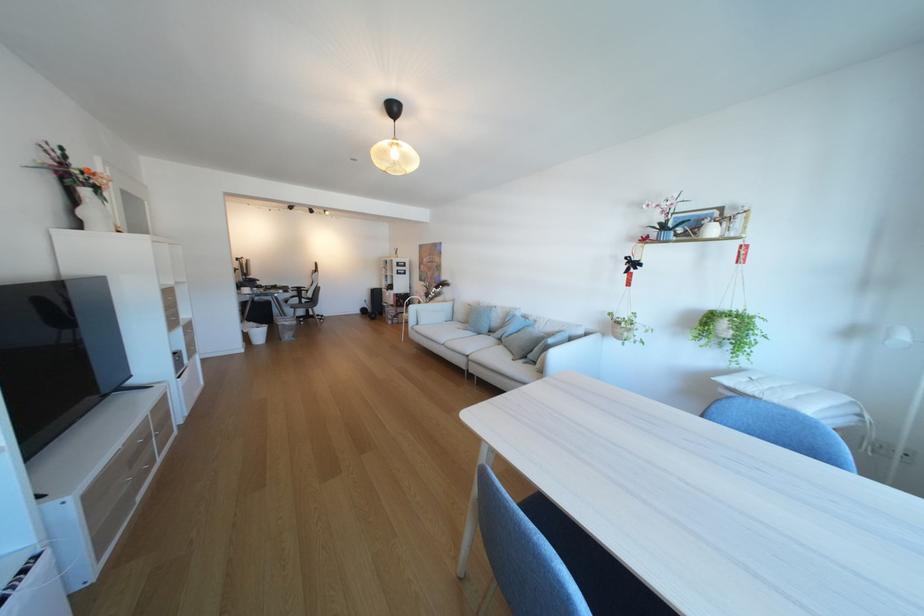
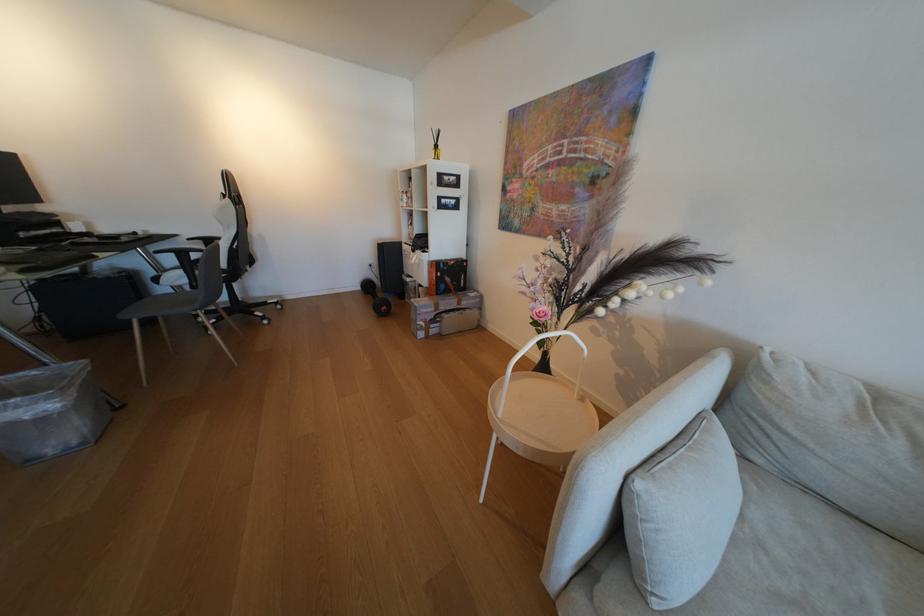
Question: The images are taken continuously from a first-person perspective. In which direction are you moving?

Choices:
 (A) Left
 (B) Right
 (C) Forward
 (D) Backward

Answer: (C)